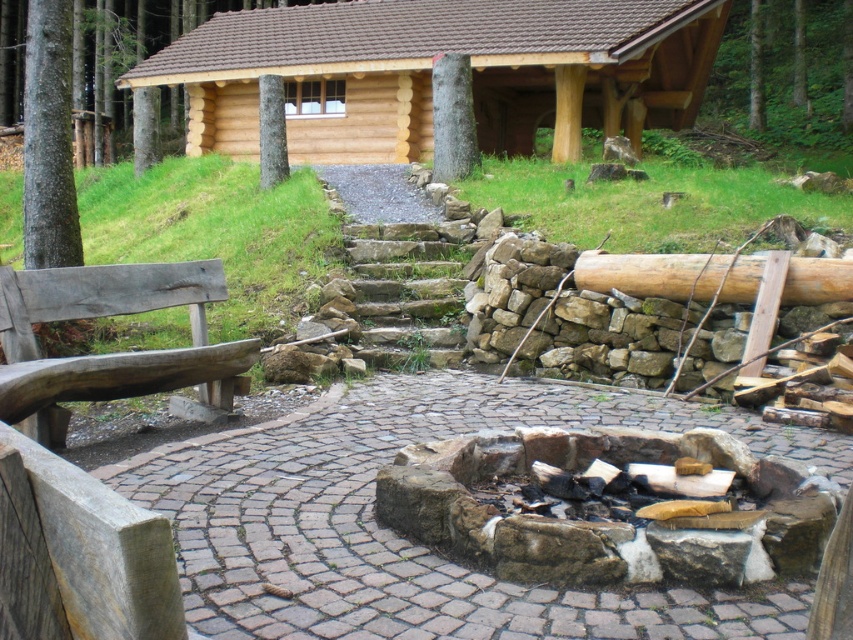
Can you confirm if wooden cabin at upper center is positioned above wooden bench at left?

Correct, wooden cabin at upper center is located above wooden bench at left.

Does wooden cabin at upper center appear under wooden bench at left?

No, wooden cabin at upper center is not below wooden bench at left.

The width and height of the screenshot is (853, 640). I want to click on wooden cabin at upper center, so click(430, 72).

This screenshot has height=640, width=853. In order to click on wooden cabin at upper center in this screenshot , I will do `click(430, 72)`.